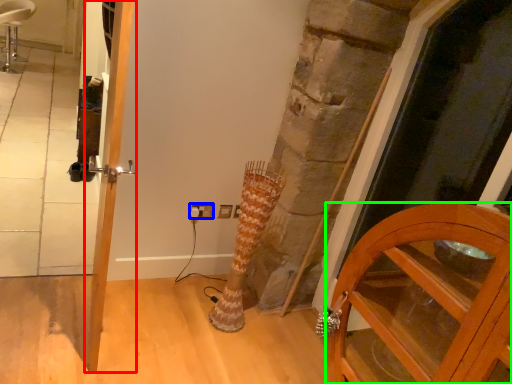
Question: Which object is the farthest from door (highlighted by a red box)? Choose among these: electric outlet (highlighted by a blue box) or cabinetry (highlighted by a green box).

Choices:
 (A) electric outlet
 (B) cabinetry

Answer: (B)